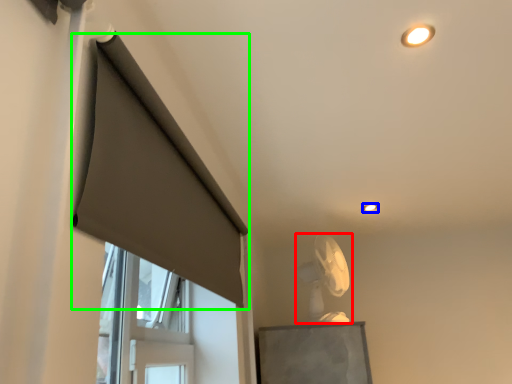
Question: Estimate the real-world distances between objects in this image. Which object is farther from fan (highlighted by a red box), lighting (highlighted by a blue box) or curtain (highlighted by a green box)?

Choices:
 (A) lighting
 (B) curtain

Answer: (B)